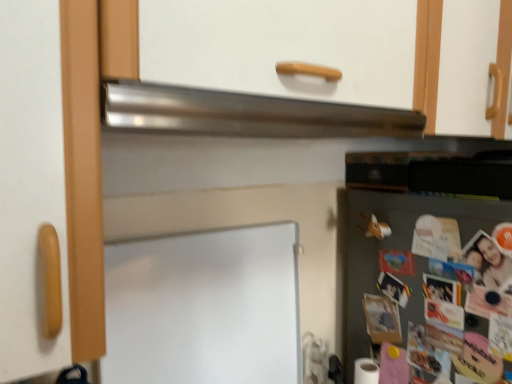
Question: Does satin metallic exhaust hood at upper center turn towards white matte board at center?

Choices:
 (A) yes
 (B) no

Answer: (B)

Question: Does satin metallic exhaust hood at upper center have a smaller size compared to white matte board at center?

Choices:
 (A) yes
 (B) no

Answer: (A)

Question: Is satin metallic exhaust hood at upper center facing away from white matte board at center?

Choices:
 (A) yes
 (B) no

Answer: (B)

Question: Would you say satin metallic exhaust hood at upper center is outside white matte board at center?

Choices:
 (A) yes
 (B) no

Answer: (A)

Question: From a real-world perspective, is satin metallic exhaust hood at upper center located higher than white matte board at center?

Choices:
 (A) no
 (B) yes

Answer: (B)

Question: Would you say satin metallic exhaust hood at upper center is inside or outside white matte board at center?

Choices:
 (A) outside
 (B) inside

Answer: (A)

Question: Is satin metallic exhaust hood at upper center bigger or smaller than white matte board at center?

Choices:
 (A) big
 (B) small

Answer: (B)

Question: From the image's perspective, is satin metallic exhaust hood at upper center positioned above or below white matte board at center?

Choices:
 (A) below
 (B) above

Answer: (B)

Question: Looking at their shapes, would you say satin metallic exhaust hood at upper center is wider or thinner than white matte board at center?

Choices:
 (A) thin
 (B) wide

Answer: (B)

Question: Which is correct: green matte fridge at lower right is inside white matte board at center, or outside of it?

Choices:
 (A) inside
 (B) outside

Answer: (B)

Question: From the image's perspective, relative to white matte board at center, is green matte fridge at lower right above or below?

Choices:
 (A) below
 (B) above

Answer: (A)

Question: Considering the positions of point (360, 256) and point (138, 372), is point (360, 256) closer or farther from the camera than point (138, 372)?

Choices:
 (A) farther
 (B) closer

Answer: (A)

Question: From a real-world perspective, is green matte fridge at lower right physically located above or below white matte board at center?

Choices:
 (A) above
 (B) below

Answer: (B)

Question: Is white matte board at center inside the boundaries of satin metallic exhaust hood at upper center, or outside?

Choices:
 (A) outside
 (B) inside

Answer: (A)

Question: Relative to satin metallic exhaust hood at upper center, is white matte board at center in front or behind?

Choices:
 (A) front
 (B) behind

Answer: (B)